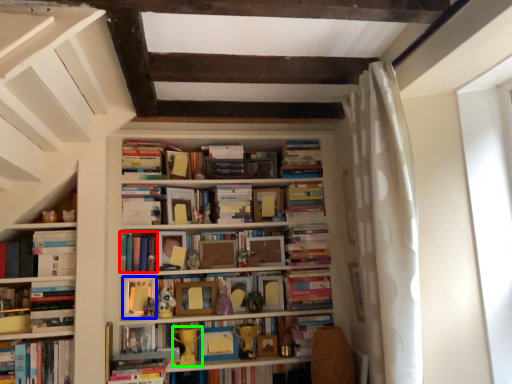
Question: Which object is the closest to the book (highlighted by a red box)? Choose among these: paperback book (highlighted by a blue box) or toy (highlighted by a green box).

Choices:
 (A) paperback book
 (B) toy

Answer: (A)